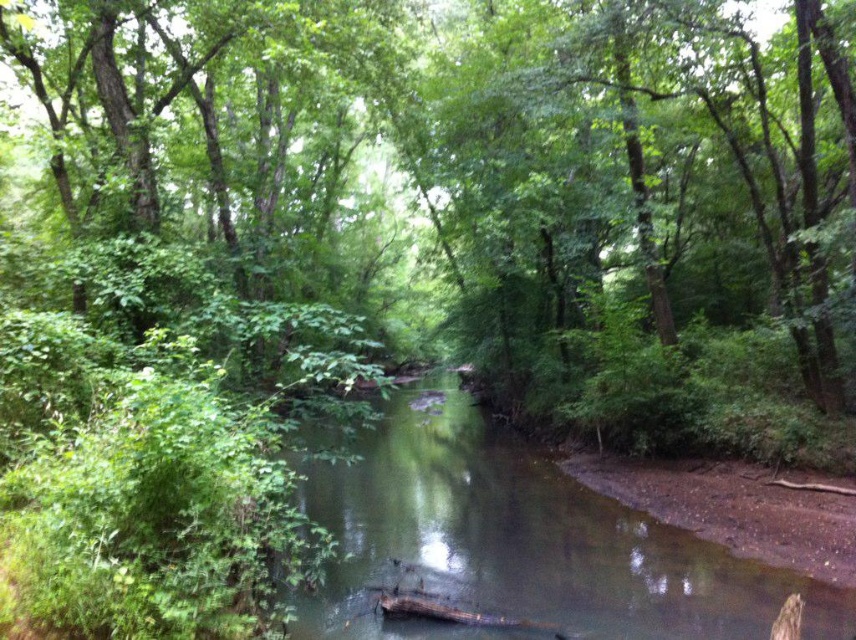
Question: Which point is closer to the camera?

Choices:
 (A) (657, 340)
 (B) (497, 538)

Answer: (B)

Question: Does green leafy tree at center appear under clear water at center?

Choices:
 (A) no
 (B) yes

Answer: (A)

Question: Can you confirm if green leafy tree at center is positioned below clear water at center?

Choices:
 (A) no
 (B) yes

Answer: (A)

Question: Is green leafy tree at center further to the viewer compared to clear water at center?

Choices:
 (A) yes
 (B) no

Answer: (B)